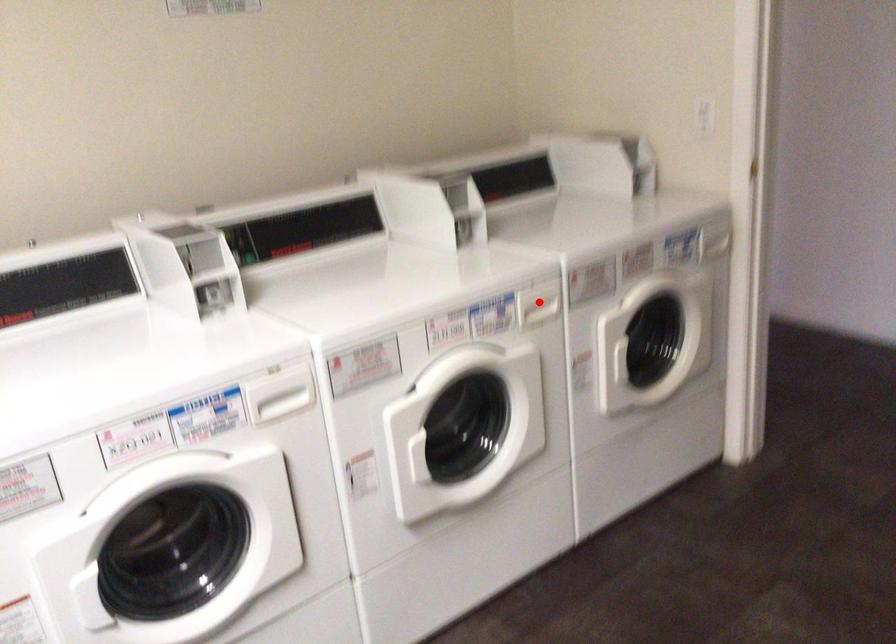
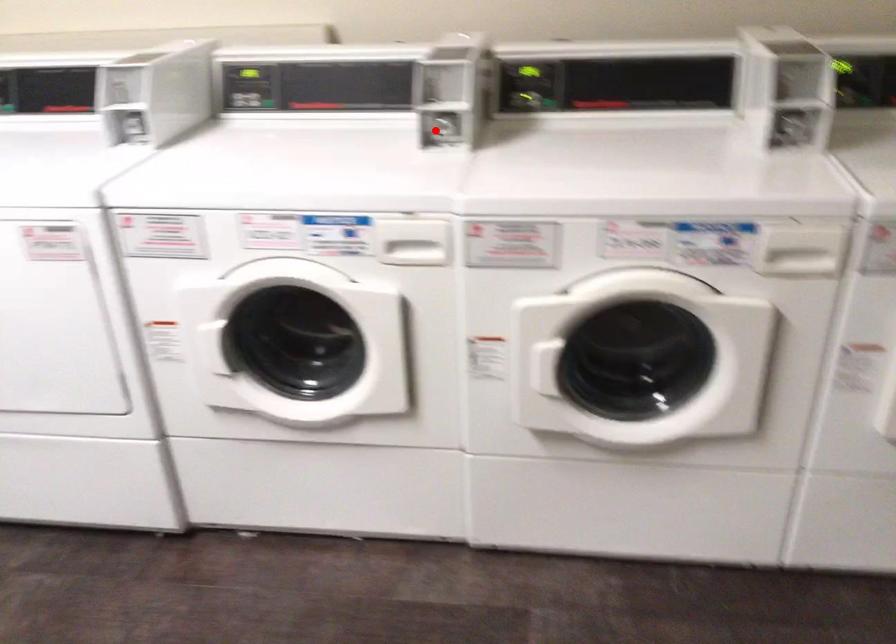
I am providing you with two images of the same scene from different viewpoints. A red point is marked on the first image and another point is marked on the second image. Are the points marked in image1 and image2 representing the same 3D position?

No